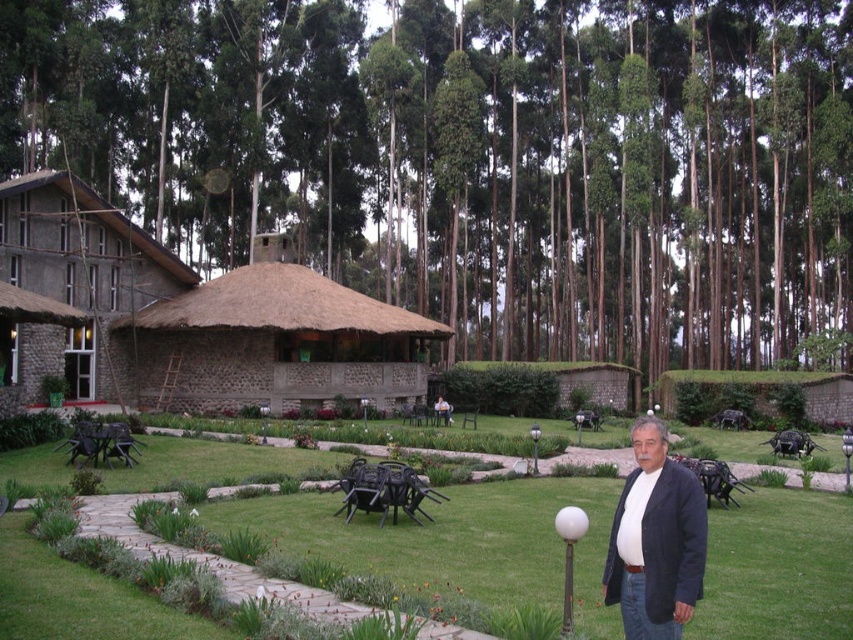
Question: Considering the real-world distances, which object is farthest from the brown thatch hut at center?

Choices:
 (A) brown thatch roof at upper center
 (B) white matte jacket at lower right
 (C) stucco thatched hut at upper left
 (D) green grass at center

Answer: (A)

Question: Considering the real-world distances, which object is closest to the brown thatch hut at center?

Choices:
 (A) brown thatch roof at upper center
 (B) stucco thatched hut at upper left
 (C) white matte jacket at lower right
 (D) green grass at center

Answer: (B)

Question: Estimate the real-world distances between objects in this image. Which object is closer to the brown thatch roof at upper center?

Choices:
 (A) green grass at center
 (B) stucco thatched hut at upper left
 (C) white matte jacket at lower right
 (D) brown thatch hut at center

Answer: (D)

Question: Can you confirm if brown thatch roof at upper center is positioned below brown thatch hut at center?

Choices:
 (A) no
 (B) yes

Answer: (A)

Question: Does brown thatch hut at center have a greater width compared to white matte jacket at lower right?

Choices:
 (A) yes
 (B) no

Answer: (A)

Question: Is brown thatch roof at upper center above white matte jacket at lower right?

Choices:
 (A) no
 (B) yes

Answer: (B)